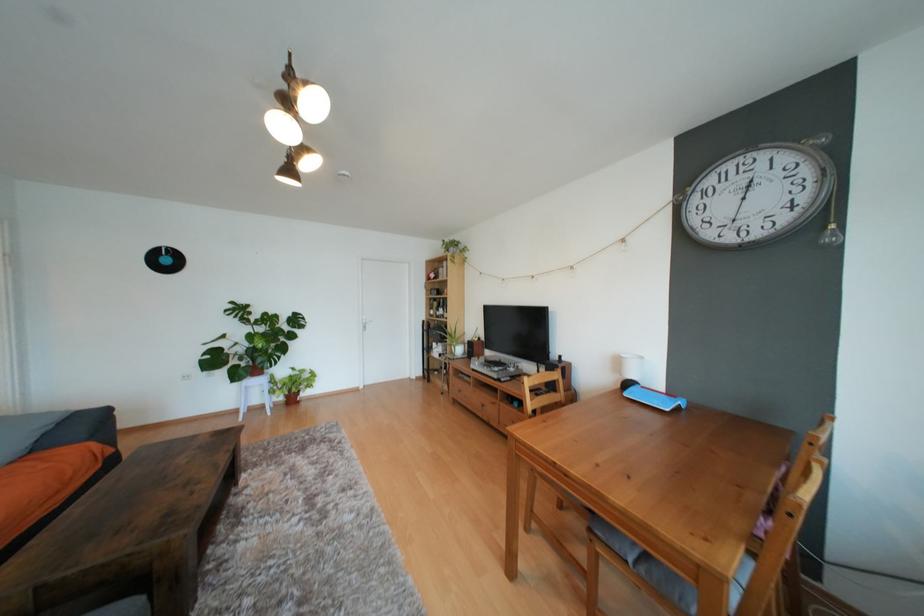
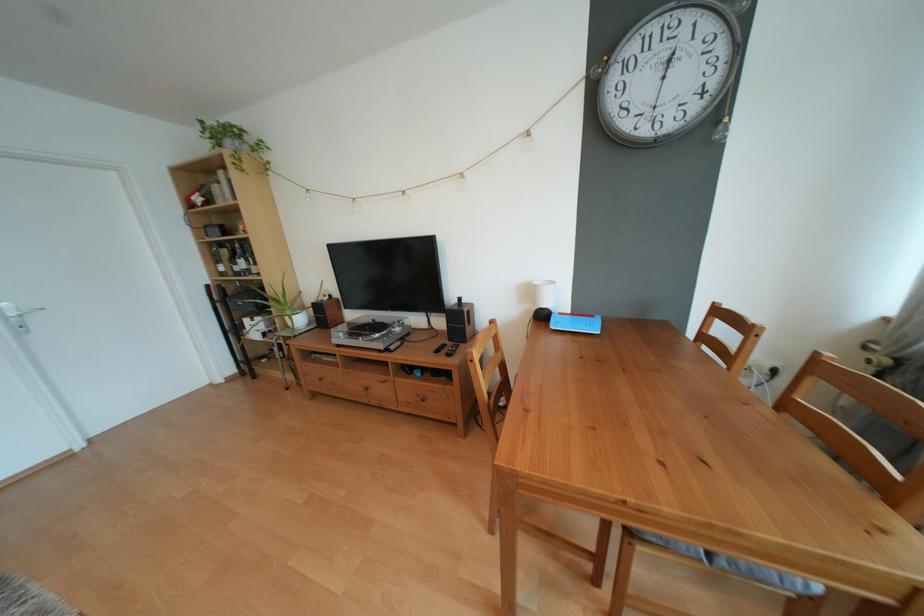
How did the camera likely rotate?

The rotation direction of the camera is right-down.